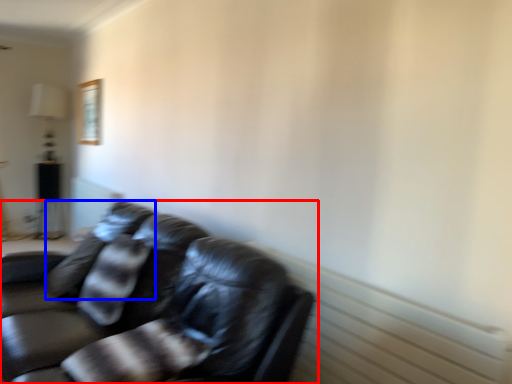
Question: Which of the following is the farthest to the observer, studio couch (highlighted by a red box) or pillow (highlighted by a blue box)?

Choices:
 (A) studio couch
 (B) pillow

Answer: (B)